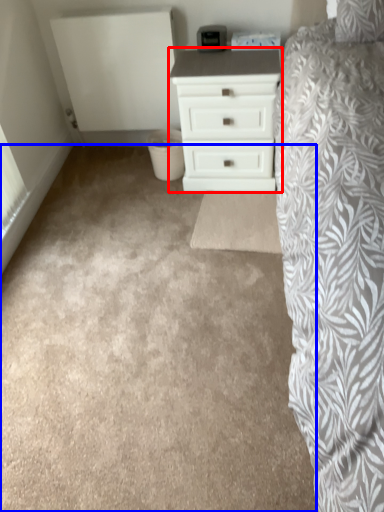
Question: Which object is further to the camera taking this photo, chest of drawers (highlighted by a red box) or plain (highlighted by a blue box)?

Choices:
 (A) chest of drawers
 (B) plain

Answer: (A)